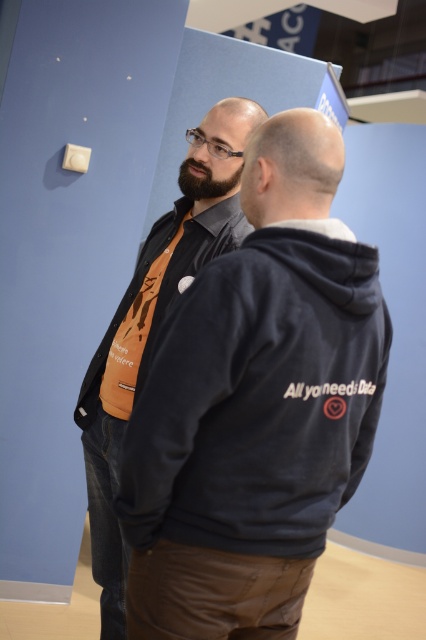
Can you confirm if matte black jacket at center is positioned to the right of matte black hoodie at center?

Incorrect, matte black jacket at center is not on the right side of matte black hoodie at center.

Between matte black jacket at center and matte black hoodie at center, which one appears on the left side from the viewer's perspective?

From the viewer's perspective, matte black jacket at center appears more on the left side.

Locate an element on the screen. matte black jacket at center is located at coordinates coord(155,324).

The width and height of the screenshot is (426, 640). I want to click on matte black jacket at center, so click(x=155, y=324).

Between dark blue fleece at center and matte black jacket at center, which one is positioned lower?

matte black jacket at center

Measure the distance between dark blue fleece at center and camera.

dark blue fleece at center is 1.11 meters from camera.

The image size is (426, 640). What do you see at coordinates (259, 397) in the screenshot?
I see `dark blue fleece at center` at bounding box center [259, 397].

At what (x,y) coordinates should I click in order to perform the action: click on dark blue fleece at center. Please return your answer as a coordinate pair (x, y). This screenshot has height=640, width=426. Looking at the image, I should click on (259, 397).

Measure the distance between dark blue fleece at center and matte black hoodie at center.

A distance of 57.43 centimeters exists between dark blue fleece at center and matte black hoodie at center.

Between dark blue fleece at center and matte black hoodie at center, which one is positioned higher?

matte black hoodie at center is above.

Locate an element on the screen. The width and height of the screenshot is (426, 640). dark blue fleece at center is located at coordinates (259, 397).